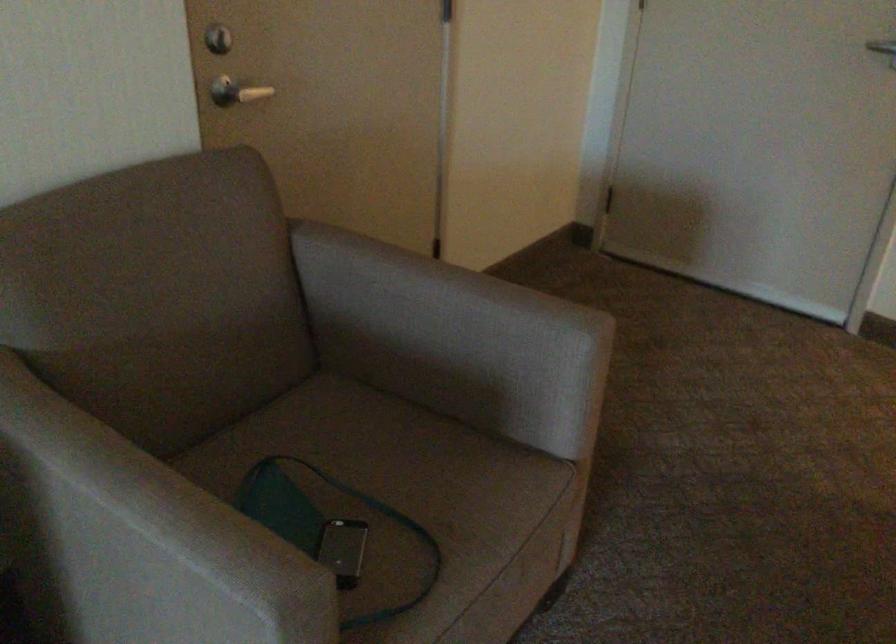
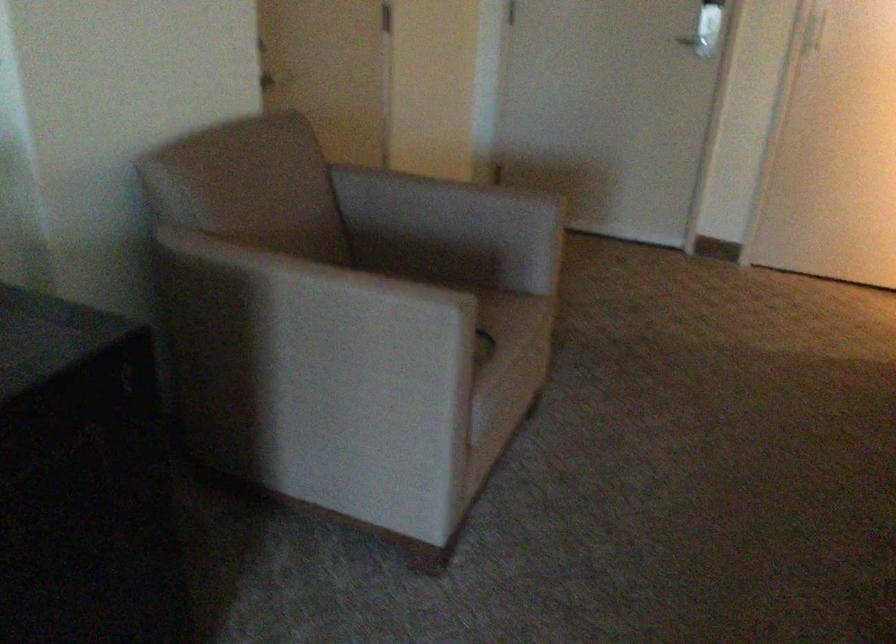
In a continuous first-person perspective shot, in which direction is the camera moving?

The cameraman walked toward left, backward.